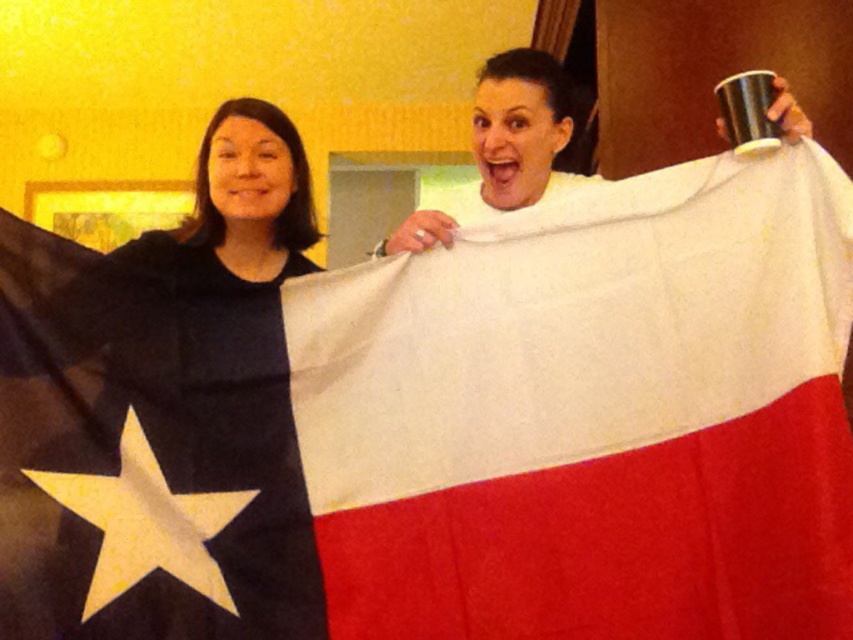
Question: Is matte black shirt at left positioned at the back of white matte cup at upper center?

Choices:
 (A) yes
 (B) no

Answer: (A)

Question: Which object is closer to the camera taking this photo?

Choices:
 (A) white matte cup at upper center
 (B) matte black shirt at left

Answer: (A)

Question: Which point is farther to the camera?

Choices:
 (A) white matte cup at upper center
 (B) matte black shirt at left

Answer: (B)

Question: Is matte black shirt at left to the left of white matte cup at upper center from the viewer's perspective?

Choices:
 (A) no
 (B) yes

Answer: (B)

Question: Which point is closer to the camera?

Choices:
 (A) (231, 145)
 (B) (555, 97)

Answer: (A)

Question: Does matte black shirt at left have a lesser width compared to white matte cup at upper center?

Choices:
 (A) yes
 (B) no

Answer: (A)